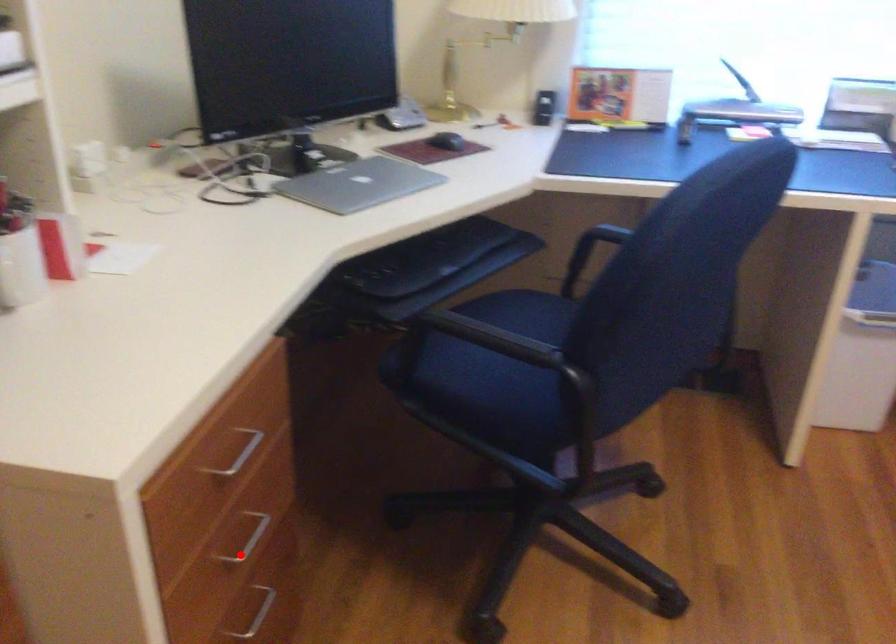
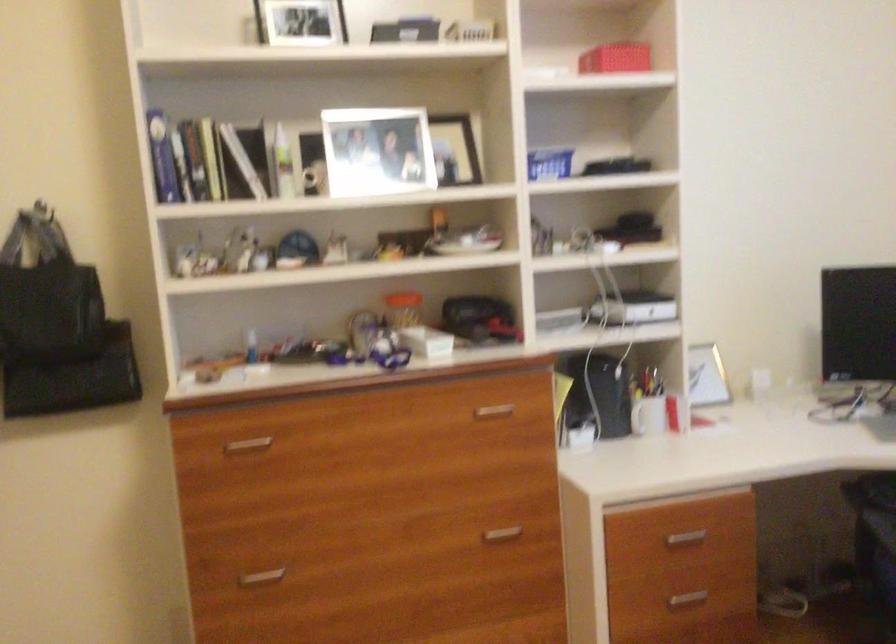
Find the pixel in the second image that matches the highlighted location in the first image.

(686, 599)